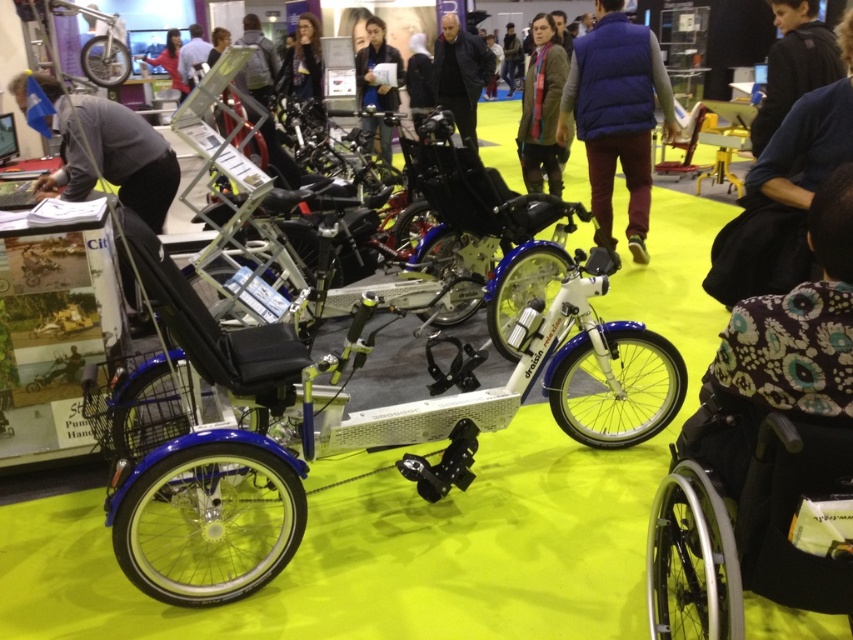
Question: Among these points, which one is farthest from the camera?

Choices:
 (A) tap(846, 461)
 (B) tap(367, 36)

Answer: (B)

Question: Can you confirm if gray fabric at left is smaller than matte pink shirt at upper left?

Choices:
 (A) yes
 (B) no

Answer: (B)

Question: Can you confirm if dark blue fabric at lower right is bigger than matte pink shirt at upper left?

Choices:
 (A) no
 (B) yes

Answer: (A)

Question: Which point is farther from the camera taking this photo?

Choices:
 (A) (173, 51)
 (B) (438, 100)
 (C) (204, 54)
 (D) (543, 67)

Answer: (A)

Question: Is blue down vest at center to the left of black fabric jacket at upper right from the viewer's perspective?

Choices:
 (A) no
 (B) yes

Answer: (B)

Question: Which point is farther from the camera taking this photo?

Choices:
 (A) 169,52
 (B) 128,112

Answer: (A)